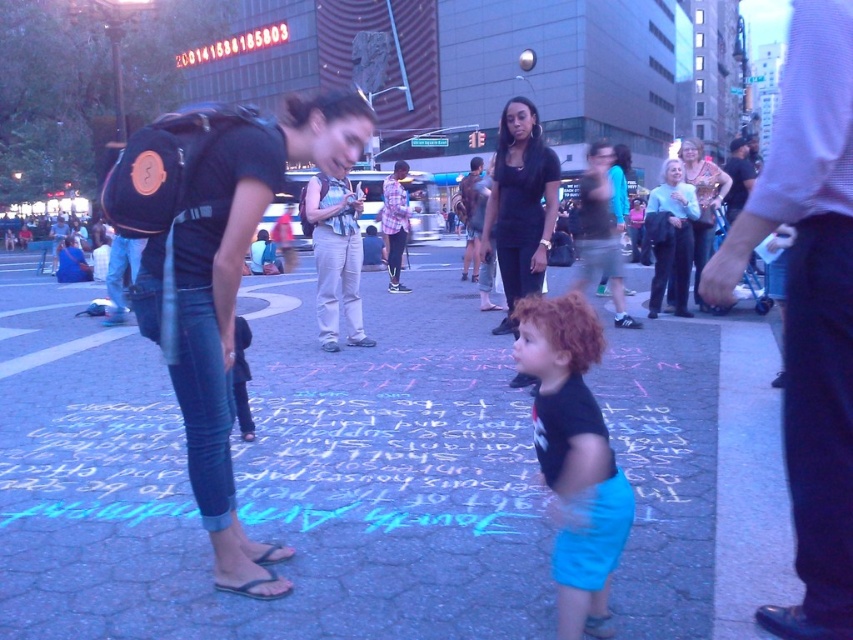
Does point (848, 470) come farther from viewer compared to point (721, 192)?

No.

Measure the distance from black fabric shirt at center to matte black tank top at center.

black fabric shirt at center and matte black tank top at center are 3.28 meters apart.

Who is more distant from viewer, (x=824, y=54) or (x=674, y=298)?

Positioned behind is point (x=674, y=298).

Where is `black fabric shirt at center`? black fabric shirt at center is located at coordinates (810, 307).

Is point (784, 442) behind point (500, 116)?

No, it is in front of (500, 116).

I want to click on black fabric shirt at center, so click(x=810, y=307).

Based on the photo, between blue brick pavement at center and black cotton shirt at center, which one has more height?

With more height is blue brick pavement at center.

Which is above, blue brick pavement at center or black cotton shirt at center?

Positioned higher is blue brick pavement at center.

Which is behind, point (297, 525) or point (523, 314)?

The point (297, 525) is more distant.

This screenshot has width=853, height=640. In order to click on blue brick pavement at center in this screenshot , I will do `click(271, 474)`.